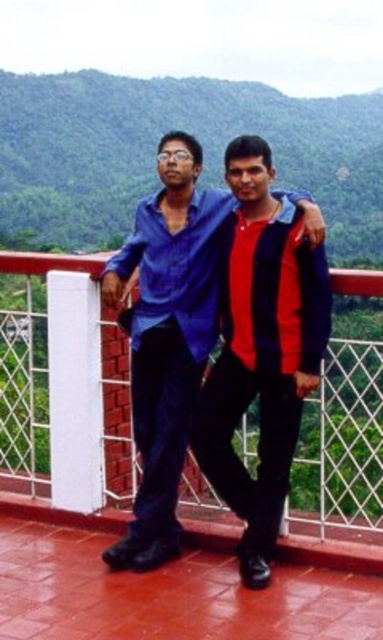
Question: Does white metal/rail at center come behind green leafy mountain at upper center?

Choices:
 (A) no
 (B) yes

Answer: (A)

Question: Can you confirm if green leafy mountain at upper center is positioned below matte blue shirt at center?

Choices:
 (A) yes
 (B) no

Answer: (B)

Question: Which point is closer to the camera?

Choices:
 (A) [x=342, y=426]
 (B) [x=96, y=99]
 (C) [x=181, y=289]

Answer: (A)

Question: Which point appears closest to the camera in this image?

Choices:
 (A) (345, 342)
 (B) (152, 451)
 (C) (6, 186)

Answer: (A)

Question: Is white metal/rail at center above matte blue shirt at center?

Choices:
 (A) no
 (B) yes

Answer: (A)

Question: Which object is the closest to the white metal/rail at center?

Choices:
 (A) green leafy mountain at upper center
 (B) matte blue shirt at center

Answer: (B)